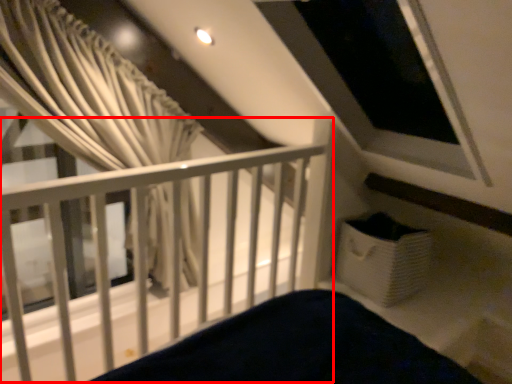
Question: From the image's perspective, what is the correct spatial relationship of rail (annotated by the red box) in relation to curtain?

Choices:
 (A) above
 (B) below

Answer: (B)